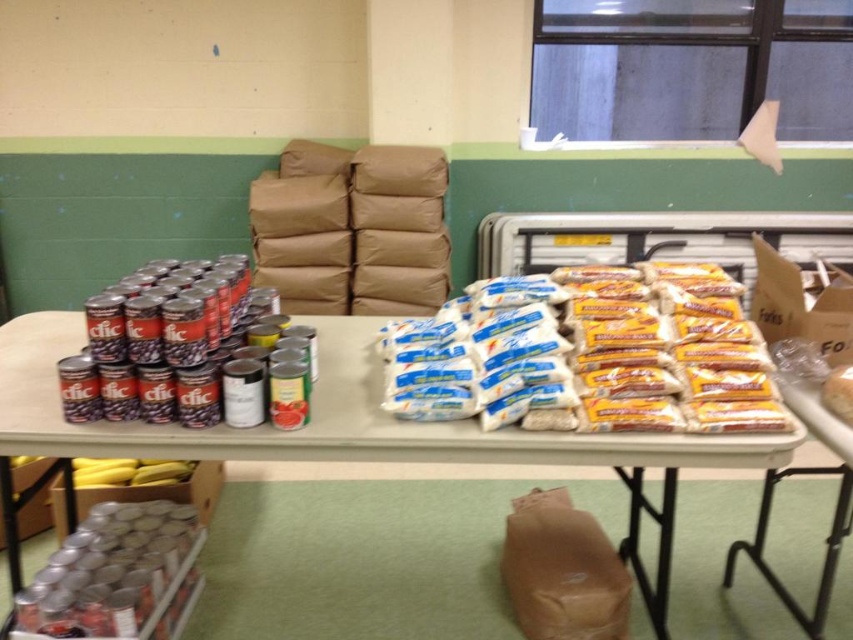
You are a volunteer at the food distribution event and need to place a new box of pasta on the table. The box is 30 cm tall. Can you determine if there is enough vertical space between the white paper bag at center and the white plastic table at center to place the box?

The white paper bag at center is further to the viewer than the white plastic table at center, so there is enough vertical space to place the box between them as the bag is closer and the table is behind it.

You are organizing a food distribution event and need to place a new box of pasta on the table. The box is too large to fit between the white paper bag at center and the white plastic table at center. Where should you place it?

The white paper bag at center is to the right of the white plastic table at center, so the space between them is narrow. To place the large box of pasta, you should move either the white paper bag at center or the white plastic table at center to create more space.

You are organizing a food distribution event and need to place a new box of snacks on the table. The box is the same size as the white paper bag at center. Will there be enough space on the white plastic table at center to accommodate the new box without overlapping any existing items?

The white paper bag at center occupies less space than the white plastic table at center, so there should be sufficient space to place the new box of snacks on the white plastic table at center without overlapping existing items.